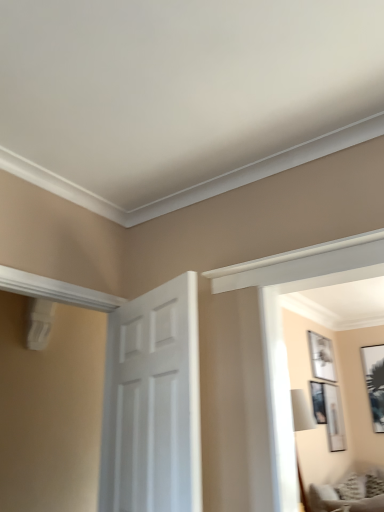
Measure the distance between matte black picture frame at upper right, the 3th picture frame viewed from the left, and camera.

matte black picture frame at upper right, the 3th picture frame viewed from the left, is 4.47 meters away from camera.

What do you see at coordinates (321, 357) in the screenshot?
I see `white matte picture frame at upper right, placed as the second picture frame when sorted from left to right` at bounding box center [321, 357].

What do you see at coordinates (153, 403) in the screenshot? I see `white matte door at center` at bounding box center [153, 403].

I want to click on matte black picture frame at upper right, which is counted as the fourth picture frame, starting from the right, so pos(318,402).

From the image's perspective, relative to black glossy picture frame at upper right, the 4th picture frame when ordered from left to right, is white matte picture frame at upper right, the third picture frame from the right, above or below?

From the image's perspective, white matte picture frame at upper right, the third picture frame from the right, appears above black glossy picture frame at upper right, the 4th picture frame when ordered from left to right.

Is white matte picture frame at upper right, the third picture frame from the right, not inside black glossy picture frame at upper right, the 4th picture frame when ordered from left to right?

white matte picture frame at upper right, the third picture frame from the right, lies outside black glossy picture frame at upper right, the 4th picture frame when ordered from left to right,'s area.

Considering the positions of objects white matte picture frame at upper right, placed as the second picture frame when sorted from left to right, and black glossy picture frame at upper right, which appears as the 1th picture frame when viewed from the right, in the image provided, who is more to the left, white matte picture frame at upper right, placed as the second picture frame when sorted from left to right, or black glossy picture frame at upper right, which appears as the 1th picture frame when viewed from the right,?

white matte picture frame at upper right, placed as the second picture frame when sorted from left to right, is more to the left.

Is white matte door at center in front of or behind matte black picture frame at upper right, which is counted as the fourth picture frame, starting from the right, in the image?

Visually, white matte door at center is located in front of matte black picture frame at upper right, which is counted as the fourth picture frame, starting from the right.

Between white matte door at center and matte black picture frame at upper right, which is counted as the fourth picture frame, starting from the right, which one has more height?

white matte door at center is taller.

Is white matte door at center wider or thinner than matte black picture frame at upper right, acting as the 1th picture frame starting from the left?

Considering their sizes, white matte door at center looks broader than matte black picture frame at upper right, acting as the 1th picture frame starting from the left.

The width and height of the screenshot is (384, 512). What are the coordinates of `the 1st picture frame to the right of the white matte picture frame at upper right, the third picture frame from the right, counting from the anchor's position` in the screenshot? It's located at (329, 413).

Between point (328, 403) and point (318, 337), which one is positioned behind?

The point (318, 337) is farther from the camera.

Would you say matte black picture frame at upper right, the 3th picture frame viewed from the left, is to the left or to the right of white matte picture frame at upper right, the third picture frame from the right, in the picture?

matte black picture frame at upper right, the 3th picture frame viewed from the left, is to the right of white matte picture frame at upper right, the third picture frame from the right.

Is matte black picture frame at upper right, the 3th picture frame viewed from the left, taller than white matte picture frame at upper right, placed as the second picture frame when sorted from left to right?

Correct, matte black picture frame at upper right, the 3th picture frame viewed from the left, is much taller as white matte picture frame at upper right, placed as the second picture frame when sorted from left to right.

Is matte black picture frame at upper right, acting as the 1th picture frame starting from the left, further to camera compared to black glossy picture frame at upper right, the 4th picture frame when ordered from left to right?

No, it is not.

Considering the positions of objects matte black picture frame at upper right, acting as the 1th picture frame starting from the left, and black glossy picture frame at upper right, the 4th picture frame when ordered from left to right, in the image provided, who is more to the left, matte black picture frame at upper right, acting as the 1th picture frame starting from the left, or black glossy picture frame at upper right, the 4th picture frame when ordered from left to right,?

matte black picture frame at upper right, acting as the 1th picture frame starting from the left.

Which is farther from the camera, [324,413] or [378,402]?

Point [378,402]

Which is correct: matte black picture frame at upper right, acting as the 1th picture frame starting from the left, is inside black glossy picture frame at upper right, the 4th picture frame when ordered from left to right, or outside of it?

matte black picture frame at upper right, acting as the 1th picture frame starting from the left, cannot be found inside black glossy picture frame at upper right, the 4th picture frame when ordered from left to right.

Which of these two, textured gray sofa at lower right or matte black picture frame at upper right, positioned as the 2th picture frame in right-to-left order, stands taller?

matte black picture frame at upper right, positioned as the 2th picture frame in right-to-left order.

Does point (324, 502) lie in front of point (325, 384)?

Yes, point (324, 502) is in front of point (325, 384).

Can you tell me how much textured gray sofa at lower right and matte black picture frame at upper right, the 3th picture frame viewed from the left, differ in facing direction?

13.4 degrees.

Is textured gray sofa at lower right facing towards matte black picture frame at upper right, positioned as the 2th picture frame in right-to-left order?

No, textured gray sofa at lower right does not turn towards matte black picture frame at upper right, positioned as the 2th picture frame in right-to-left order.

Is matte black picture frame at upper right, positioned as the 2th picture frame in right-to-left order, taller or shorter than black glossy picture frame at upper right, the 4th picture frame when ordered from left to right?

In the image, matte black picture frame at upper right, positioned as the 2th picture frame in right-to-left order, appears to be shorter than black glossy picture frame at upper right, the 4th picture frame when ordered from left to right.

From a real-world perspective, is matte black picture frame at upper right, positioned as the 2th picture frame in right-to-left order, under black glossy picture frame at upper right, the 4th picture frame when ordered from left to right?

Indeed, from a real-world perspective, matte black picture frame at upper right, positioned as the 2th picture frame in right-to-left order, is positioned beneath black glossy picture frame at upper right, the 4th picture frame when ordered from left to right.

Based on their sizes in the image, would you say matte black picture frame at upper right, the 3th picture frame viewed from the left, is bigger or smaller than black glossy picture frame at upper right, the 4th picture frame when ordered from left to right?

Considering their sizes, matte black picture frame at upper right, the 3th picture frame viewed from the left, takes up less space than black glossy picture frame at upper right, the 4th picture frame when ordered from left to right.

Is black glossy picture frame at upper right, which appears as the 1th picture frame when viewed from the right, to the left of textured gray sofa at lower right from the viewer's perspective?

No.

Which of these two, black glossy picture frame at upper right, the 4th picture frame when ordered from left to right, or textured gray sofa at lower right, stands shorter?

textured gray sofa at lower right is shorter.

Identify the location of furniture on the left of black glossy picture frame at upper right, which appears as the 1th picture frame when viewed from the right. (343, 498).

Identify the location of picture frame behind the white matte picture frame at upper right, the third picture frame from the right. (375, 382).

You are a GUI agent. You are given a task and a screenshot of the screen. Output one action in this format:
    pyautogui.click(x=<x>, y=<y>)
    Task: Click on the door on the left of the matte black picture frame at upper right, which is counted as the fourth picture frame, starting from the right
    The image size is (384, 512).
    Given the screenshot: What is the action you would take?
    pyautogui.click(x=153, y=403)

Looking at the image, which one is located further to black glossy picture frame at upper right, the 4th picture frame when ordered from left to right, white matte door at center or matte black picture frame at upper right, the 3th picture frame viewed from the left?

Among the two, white matte door at center is located further to black glossy picture frame at upper right, the 4th picture frame when ordered from left to right.

Which object lies further to the anchor point matte black picture frame at upper right, the 3th picture frame viewed from the left, white matte door at center or textured gray sofa at lower right?

white matte door at center lies further to matte black picture frame at upper right, the 3th picture frame viewed from the left, than the other object.

Estimate the real-world distances between objects in this image. Which object is closer to white matte picture frame at upper right, the third picture frame from the right, textured gray sofa at lower right or black glossy picture frame at upper right, which appears as the 1th picture frame when viewed from the right?

The object closer to white matte picture frame at upper right, the third picture frame from the right, is black glossy picture frame at upper right, which appears as the 1th picture frame when viewed from the right.

From the picture: Estimate the real-world distances between objects in this image. Which object is closer to white matte picture frame at upper right, the third picture frame from the right, black glossy picture frame at upper right, which appears as the 1th picture frame when viewed from the right, or textured gray sofa at lower right?

Based on the image, black glossy picture frame at upper right, which appears as the 1th picture frame when viewed from the right, appears to be nearer to white matte picture frame at upper right, the third picture frame from the right.

In the scene shown: Estimate the real-world distances between objects in this image. Which object is further from textured gray sofa at lower right, white matte picture frame at upper right, placed as the second picture frame when sorted from left to right, or black glossy picture frame at upper right, the 4th picture frame when ordered from left to right?

Based on the image, black glossy picture frame at upper right, the 4th picture frame when ordered from left to right, appears to be further to textured gray sofa at lower right.

In the scene shown: Considering their positions, is textured gray sofa at lower right positioned further to matte black picture frame at upper right, positioned as the 2th picture frame in right-to-left order, than white matte door at center?

Based on the image, white matte door at center appears to be further to matte black picture frame at upper right, positioned as the 2th picture frame in right-to-left order.

Estimate the real-world distances between objects in this image. Which object is further from white matte picture frame at upper right, placed as the second picture frame when sorted from left to right, matte black picture frame at upper right, the 3th picture frame viewed from the left, or black glossy picture frame at upper right, which appears as the 1th picture frame when viewed from the right?

The object further to white matte picture frame at upper right, placed as the second picture frame when sorted from left to right, is black glossy picture frame at upper right, which appears as the 1th picture frame when viewed from the right.

Estimate the real-world distances between objects in this image. Which object is further from white matte door at center, matte black picture frame at upper right, positioned as the 2th picture frame in right-to-left order, or white matte picture frame at upper right, the third picture frame from the right?

white matte picture frame at upper right, the third picture frame from the right, lies further to white matte door at center than the other object.

What are the coordinates of `furniture between white matte door at center and white matte picture frame at upper right, placed as the second picture frame when sorted from left to right, in the front-back direction` in the screenshot? It's located at (343, 498).

At what (x,y) coordinates should I click in order to perform the action: click on picture frame between white matte picture frame at upper right, the third picture frame from the right, and black glossy picture frame at upper right, which appears as the 1th picture frame when viewed from the right. Please return your answer as a coordinate pair (x, y). This screenshot has width=384, height=512. Looking at the image, I should click on click(329, 413).

Where is `furniture located between white matte door at center and matte black picture frame at upper right, which is counted as the fourth picture frame, starting from the right, in the depth direction`? furniture located between white matte door at center and matte black picture frame at upper right, which is counted as the fourth picture frame, starting from the right, in the depth direction is located at coordinates (343, 498).

Find the location of `furniture positioned between white matte door at center and black glossy picture frame at upper right, which appears as the 1th picture frame when viewed from the right, from near to far`. furniture positioned between white matte door at center and black glossy picture frame at upper right, which appears as the 1th picture frame when viewed from the right, from near to far is located at coordinates (343, 498).